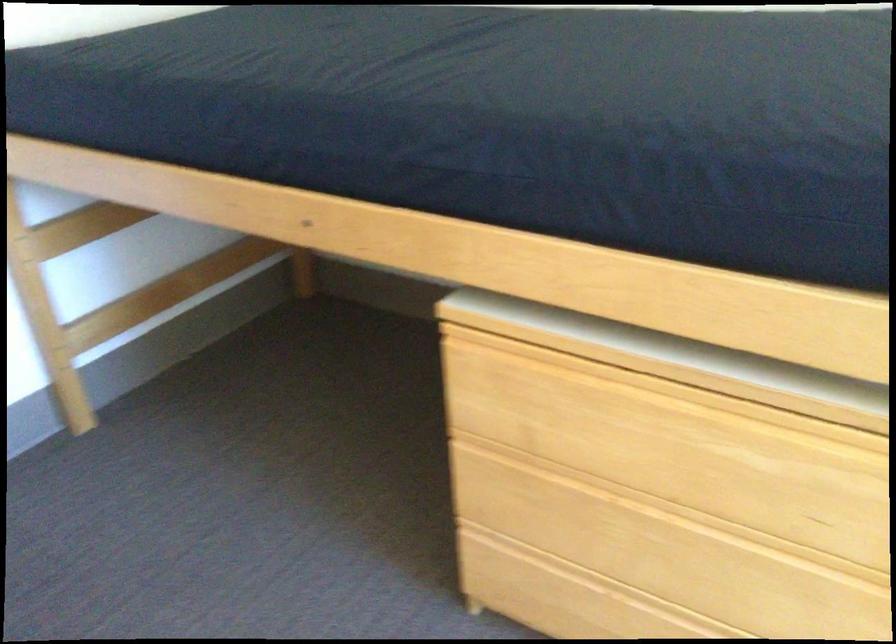
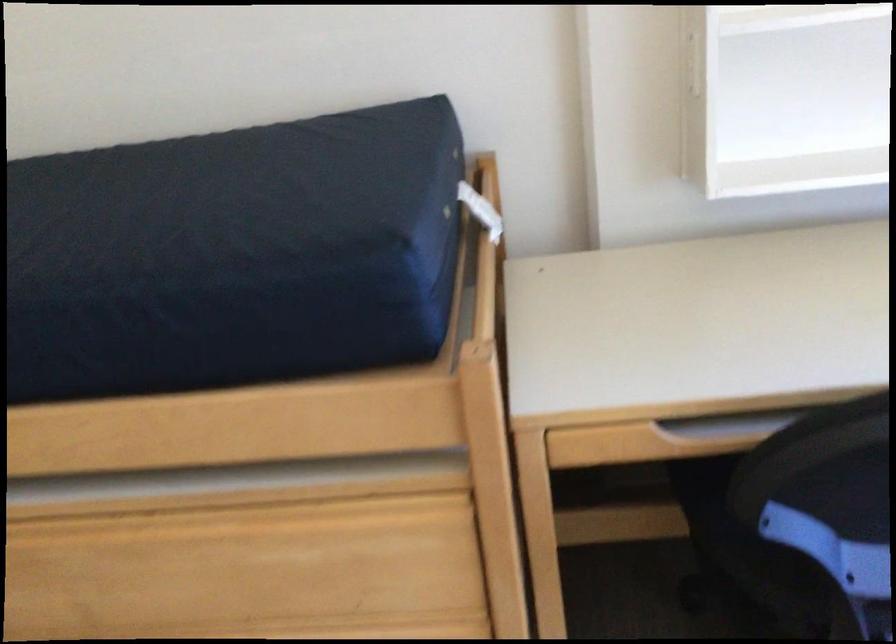
Question: The first image is from the beginning of the video and the second image is from the end. How did the camera likely rotate when shooting the video?

Choices:
 (A) Left
 (B) Right
 (C) Up
 (D) Down

Answer: (B)